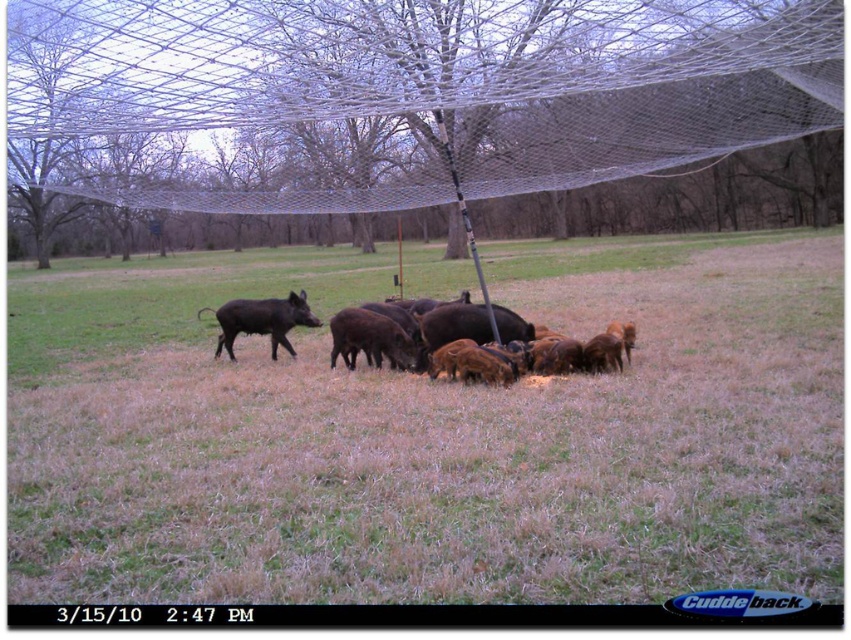
Question: Does dark brown fur piglet at center appear under dark brown fur at center?

Choices:
 (A) yes
 (B) no

Answer: (B)

Question: Which of the following is the farthest from the observer?

Choices:
 (A) dark brown fur at center
 (B) dark brown fur piglet at center

Answer: (B)

Question: Which of the following is the farthest from the observer?

Choices:
 (A) brown dry grass at center
 (B) dark brown fur at center
 (C) shiny black boar at center

Answer: (B)

Question: Does white mesh net at center have a lesser width compared to dark brown fur at center?

Choices:
 (A) yes
 (B) no

Answer: (B)

Question: Which point is closer to the camera?

Choices:
 (A) white mesh net at center
 (B) dark brown fur at center
 (C) dark brown fur piglet at center
 (D) brown dry grass at center

Answer: (D)

Question: Does brown dry grass at center have a lesser width compared to shiny black boar at center?

Choices:
 (A) no
 (B) yes

Answer: (A)